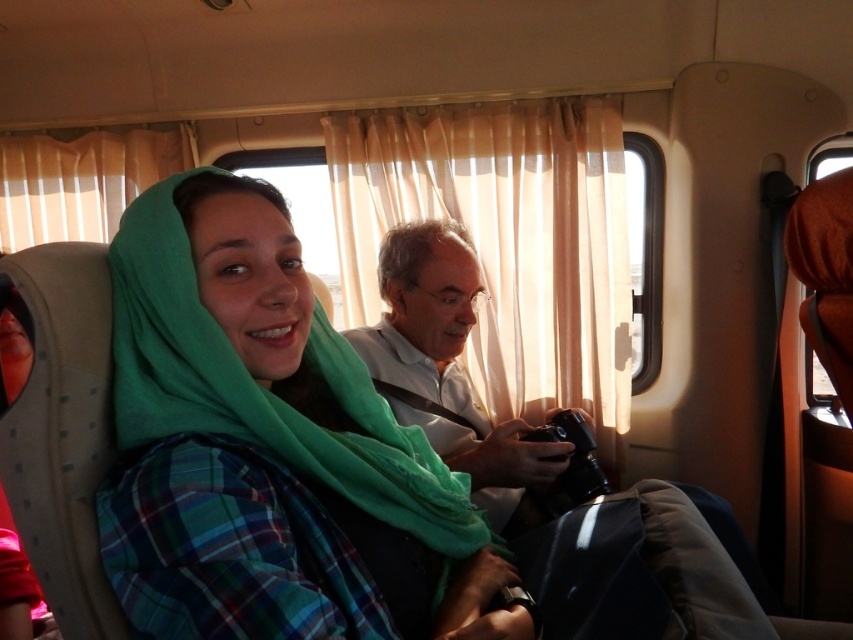
Who is taller, green fabric shawl at center or matte black camera at center?

matte black camera at center

Find the location of a particular element. green fabric shawl at center is located at coordinates (265, 445).

Image resolution: width=853 pixels, height=640 pixels. What are the coordinates of `green fabric shawl at center` in the screenshot? It's located at (265, 445).